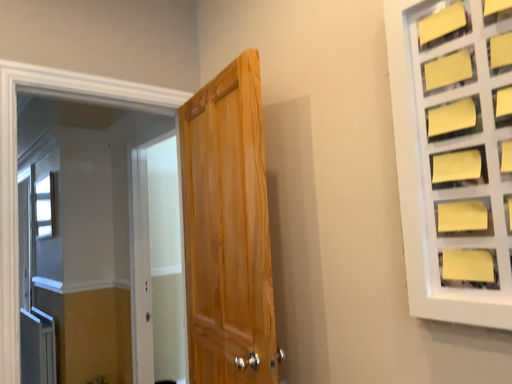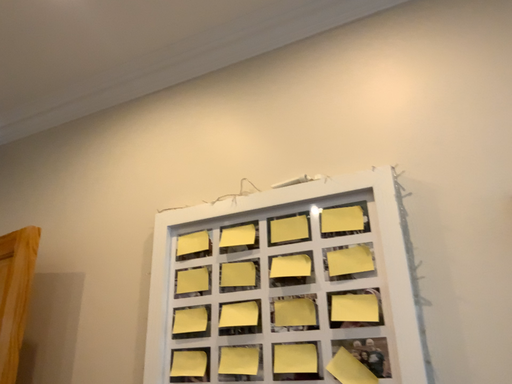
Question: How did the camera likely rotate when shooting the video?

Choices:
 (A) rotated downward
 (B) rotated upward

Answer: (B)